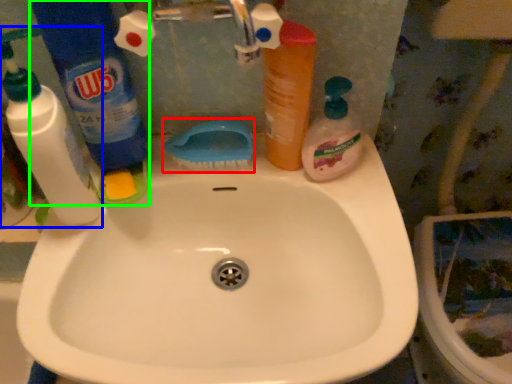
Question: Estimate the real-world distances between objects in this image. Which object is farther from brush (highlighted by a red box), cleaning product (highlighted by a blue box) or cleaning product (highlighted by a green box)?

Choices:
 (A) cleaning product
 (B) cleaning product

Answer: (A)